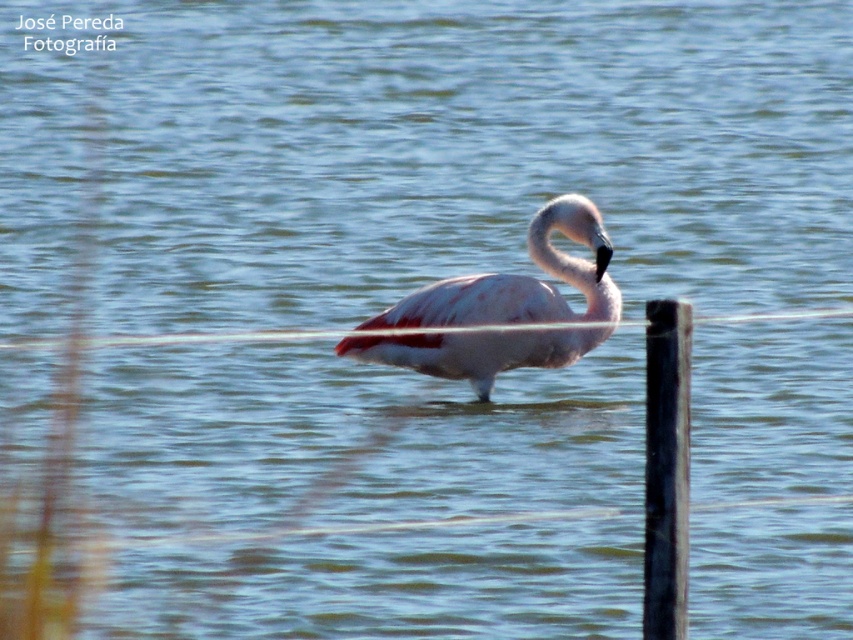
Question: Where is pink feathered flamingo at center located in relation to black smooth post at right in the image?

Choices:
 (A) above
 (B) below

Answer: (A)

Question: Does pink feathered flamingo at center appear on the left side of black smooth post at right?

Choices:
 (A) no
 (B) yes

Answer: (B)

Question: Considering the relative positions of pink feathered flamingo at center and black smooth post at right in the image provided, where is pink feathered flamingo at center located with respect to black smooth post at right?

Choices:
 (A) right
 (B) left

Answer: (B)

Question: Which object appears farthest from the camera in this image?

Choices:
 (A) pink feathered flamingo at center
 (B) black smooth post at right

Answer: (A)